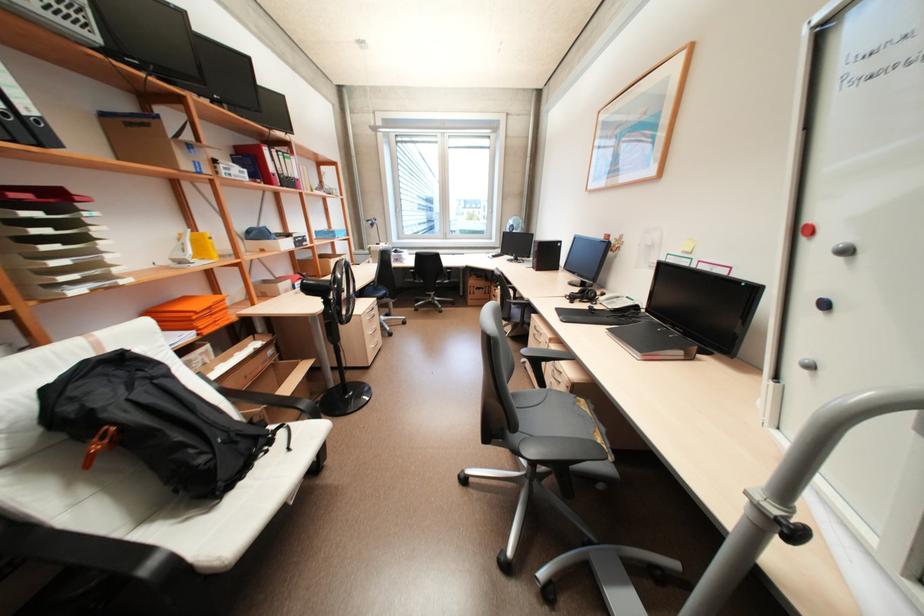
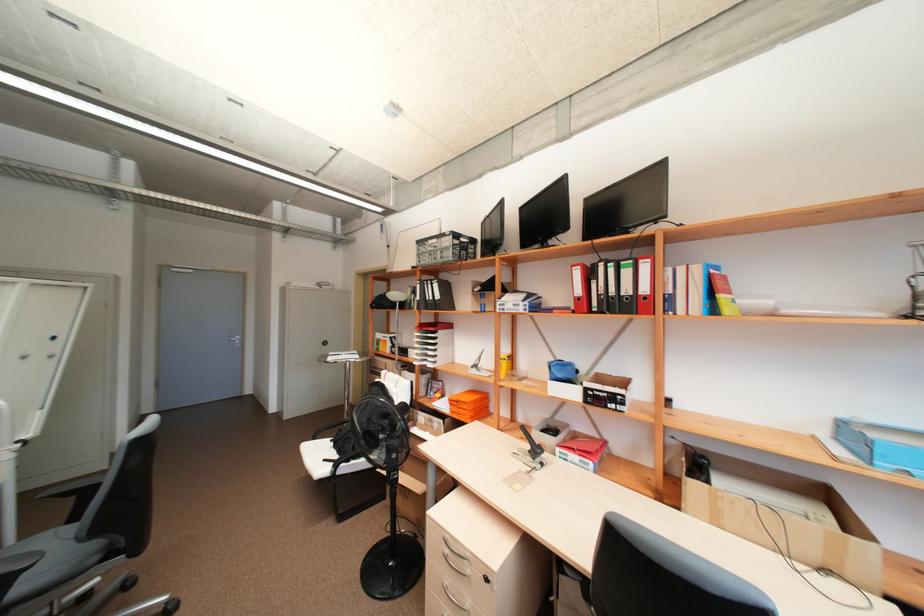
Locate, in the second image, the point that corresponds to the point at 215,307 in the first image.

(463, 400)